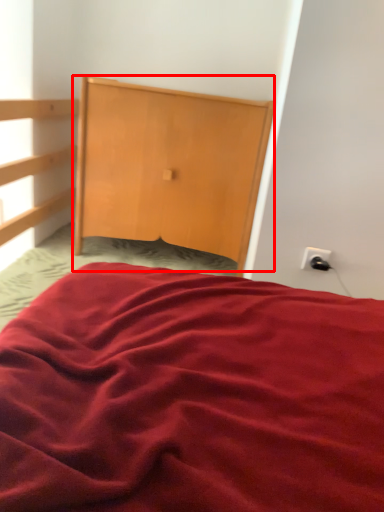
Question: Where is dresser (annotated by the red box) located in relation to electric outlet in the image?

Choices:
 (A) left
 (B) right

Answer: (A)